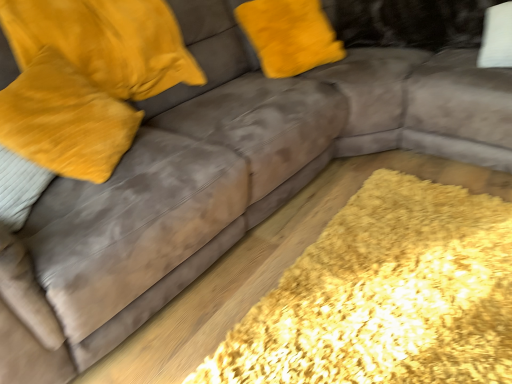
What do you see at coordinates (386, 296) in the screenshot? Image resolution: width=512 pixels, height=384 pixels. I see `yellow shaggy rug at lower right` at bounding box center [386, 296].

Measure the distance between velvet yellow pillow at left, acting as the 2th pillow starting from the right, and camera.

They are 4.08 feet apart.

At what (x,y) coordinates should I click in order to perform the action: click on velvet yellow pillow at upper left, which appears as the 1th pillow when viewed from the right. Please return your answer as a coordinate pair (x, y). The image size is (512, 384). Looking at the image, I should click on (105, 42).

Image resolution: width=512 pixels, height=384 pixels. I want to click on yellow shaggy rug at lower right, so click(x=386, y=296).

Measure the distance between velvet yellow pillow at upper left, the second pillow viewed from the left, and velvet yellow pillow at left, acting as the 2th pillow starting from the right.

velvet yellow pillow at upper left, the second pillow viewed from the left, and velvet yellow pillow at left, acting as the 2th pillow starting from the right, are 9.16 inches apart.

Looking at this image, is velvet yellow pillow at left, acting as the 2th pillow starting from the right, inside velvet yellow pillow at upper left, the second pillow viewed from the left?

No, velvet yellow pillow at left, acting as the 2th pillow starting from the right, is not inside velvet yellow pillow at upper left, the second pillow viewed from the left.

Considering the positions of point (141, 42) and point (76, 176), is point (141, 42) closer or farther from the camera than point (76, 176)?

Point (141, 42) is positioned farther from the camera compared to point (76, 176).

Who is taller, velvet yellow pillow at upper left, which appears as the 1th pillow when viewed from the right, or velvet yellow pillow at left, acting as the 2th pillow starting from the right?

With more height is velvet yellow pillow at left, acting as the 2th pillow starting from the right.

Which object is thinner, velvet yellow pillow at upper left, the second pillow viewed from the left, or yellow shaggy rug at lower right?

velvet yellow pillow at upper left, the second pillow viewed from the left.

Which object is more forward, velvet yellow pillow at upper left, the second pillow viewed from the left, or yellow shaggy rug at lower right?

yellow shaggy rug at lower right.

Looking at this image, which is correct: velvet yellow pillow at upper left, which appears as the 1th pillow when viewed from the right, is inside yellow shaggy rug at lower right, or outside of it?

velvet yellow pillow at upper left, which appears as the 1th pillow when viewed from the right, is located beyond the bounds of yellow shaggy rug at lower right.

Where is `mat that appears below the velvet yellow pillow at upper left, the second pillow viewed from the left (from a real-world perspective)`? This screenshot has width=512, height=384. mat that appears below the velvet yellow pillow at upper left, the second pillow viewed from the left (from a real-world perspective) is located at coordinates (386, 296).

Is velvet yellow pillow at left, which is counted as the first pillow, starting from the left, positioned with its back to yellow shaggy rug at lower right?

velvet yellow pillow at left, which is counted as the first pillow, starting from the left, does not have its back to yellow shaggy rug at lower right.

Can you confirm if velvet yellow pillow at left, acting as the 2th pillow starting from the right, is smaller than yellow shaggy rug at lower right?

Incorrect, velvet yellow pillow at left, acting as the 2th pillow starting from the right, is not smaller in size than yellow shaggy rug at lower right.

Find the location of `pillow that is the 1st object above the yellow shaggy rug at lower right (from a real-world perspective)`. pillow that is the 1st object above the yellow shaggy rug at lower right (from a real-world perspective) is located at coordinates tap(65, 120).

Which object is more forward, velvet yellow pillow at left, which is counted as the first pillow, starting from the left, or yellow shaggy rug at lower right?

Positioned in front is yellow shaggy rug at lower right.

Which object is closer to the camera taking this photo, yellow shaggy rug at lower right or velvet yellow pillow at upper left, the second pillow viewed from the left?

yellow shaggy rug at lower right.

Consider the image. Which point is more forward, (x=295, y=335) or (x=169, y=69)?

The point (x=295, y=335) is closer.

From the image's perspective, which is above, yellow shaggy rug at lower right or velvet yellow pillow at upper left, the second pillow viewed from the left?

From the image's view, velvet yellow pillow at upper left, the second pillow viewed from the left, is above.

Between velvet yellow pillow at left, which is counted as the first pillow, starting from the left, and velvet yellow pillow at upper left, the second pillow viewed from the left, which one has larger size?

velvet yellow pillow at upper left, the second pillow viewed from the left, is bigger.

What's the angular difference between velvet yellow pillow at left, which is counted as the first pillow, starting from the left, and velvet yellow pillow at upper left, which appears as the 1th pillow when viewed from the right,'s facing directions?

They differ by 40.6 degrees in their facing directions.

Is velvet yellow pillow at left, which is counted as the first pillow, starting from the left, next to velvet yellow pillow at upper left, the second pillow viewed from the left, and touching it?

No.

Can you confirm if velvet yellow pillow at left, acting as the 2th pillow starting from the right, is positioned to the left of velvet yellow pillow at upper left, the second pillow viewed from the left?

Yes.

In terms of size, does yellow shaggy rug at lower right appear bigger or smaller than velvet yellow pillow at left, acting as the 2th pillow starting from the right?

Considering their sizes, yellow shaggy rug at lower right takes up less space than velvet yellow pillow at left, acting as the 2th pillow starting from the right.

Does yellow shaggy rug at lower right touch velvet yellow pillow at left, which is counted as the first pillow, starting from the left?

They are not placed beside each other.

From the image's perspective, count 1st pillows upward from the yellow shaggy rug at lower right and point to it. Please provide its 2D coordinates.

[(65, 120)]

Identify the location of pillow that appears above the velvet yellow pillow at left, acting as the 2th pillow starting from the right (from the image's perspective). (105, 42).

Locate an element on the screen. The width and height of the screenshot is (512, 384). mat in front of the velvet yellow pillow at upper left, which appears as the 1th pillow when viewed from the right is located at coordinates (386, 296).

When comparing their distances from yellow shaggy rug at lower right, does velvet yellow pillow at left, which is counted as the first pillow, starting from the left, or velvet yellow pillow at upper left, the second pillow viewed from the left, seem further?

velvet yellow pillow at upper left, the second pillow viewed from the left, lies further to yellow shaggy rug at lower right than the other object.

Which object lies further to the anchor point yellow shaggy rug at lower right, velvet yellow pillow at upper left, the second pillow viewed from the left, or velvet yellow pillow at left, acting as the 2th pillow starting from the right?

velvet yellow pillow at upper left, the second pillow viewed from the left.

In the scene shown: Which object lies nearer to the anchor point velvet yellow pillow at left, which is counted as the first pillow, starting from the left, velvet yellow pillow at upper left, which appears as the 1th pillow when viewed from the right, or yellow shaggy rug at lower right?

velvet yellow pillow at upper left, which appears as the 1th pillow when viewed from the right, lies closer to velvet yellow pillow at left, which is counted as the first pillow, starting from the left, than the other object.

Which object lies further to the anchor point velvet yellow pillow at upper left, which appears as the 1th pillow when viewed from the right, velvet yellow pillow at left, which is counted as the first pillow, starting from the left, or yellow shaggy rug at lower right?

yellow shaggy rug at lower right is further to velvet yellow pillow at upper left, which appears as the 1th pillow when viewed from the right.

Looking at the image, which one is located further to velvet yellow pillow at left, acting as the 2th pillow starting from the right, yellow shaggy rug at lower right or velvet yellow pillow at upper left, the second pillow viewed from the left?

Among the two, yellow shaggy rug at lower right is located further to velvet yellow pillow at left, acting as the 2th pillow starting from the right.

Looking at this image, considering their positions, is yellow shaggy rug at lower right positioned further to velvet yellow pillow at upper left, the second pillow viewed from the left, than velvet yellow pillow at left, acting as the 2th pillow starting from the right?

Based on the image, yellow shaggy rug at lower right appears to be further to velvet yellow pillow at upper left, the second pillow viewed from the left.

The image size is (512, 384). I want to click on pillow between velvet yellow pillow at left, which is counted as the first pillow, starting from the left, and yellow shaggy rug at lower right from left to right, so click(105, 42).